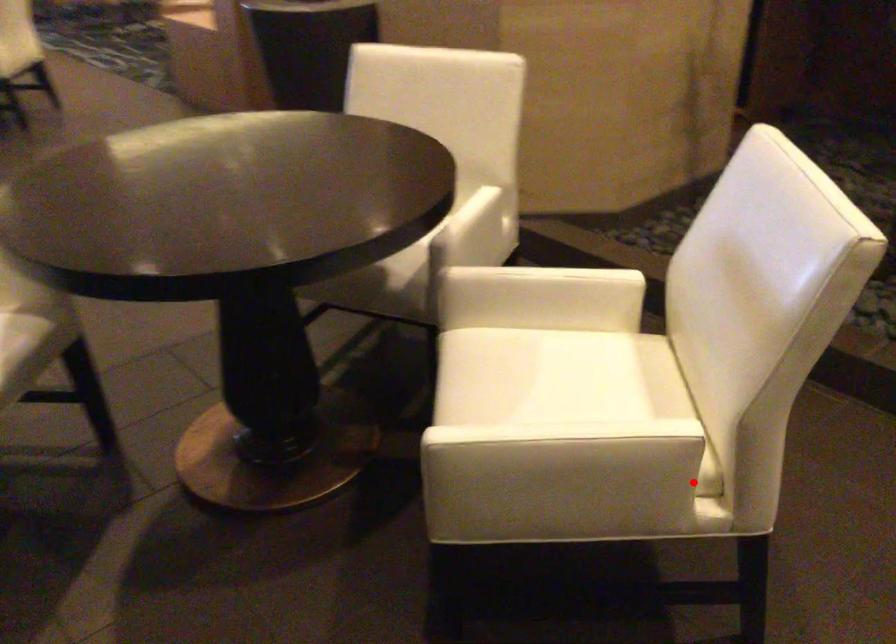
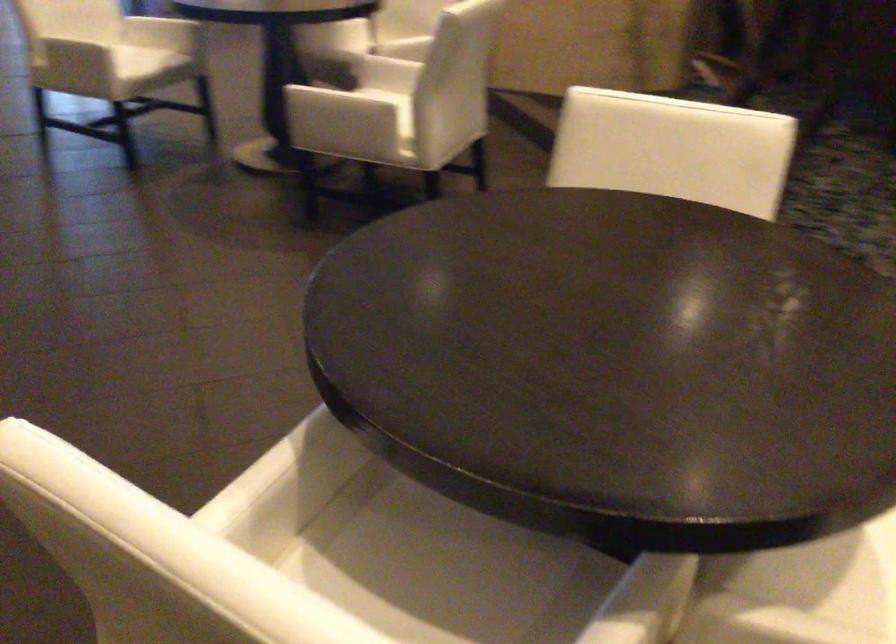
In the second image, find the point that corresponds to the highlighted location in the first image.

(371, 109)